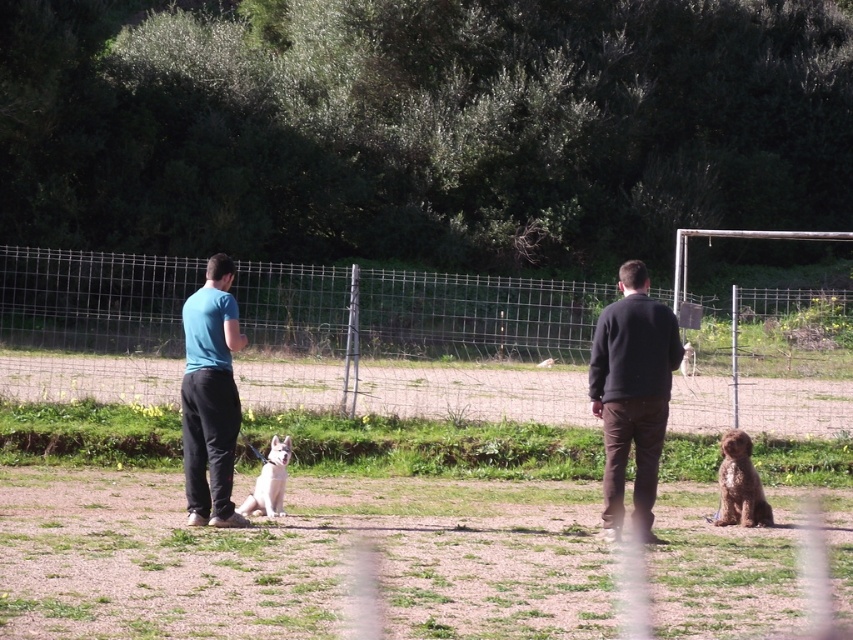
Question: Can you confirm if dark brown sweater at right is positioned to the left of blue cotton shirt at left?

Choices:
 (A) no
 (B) yes

Answer: (A)

Question: Which of the following is the farthest from the observer?

Choices:
 (A) click(x=20, y=316)
 (B) click(x=277, y=452)

Answer: (A)

Question: Can you confirm if brown dirt field at center is positioned below white fur dog at center?

Choices:
 (A) yes
 (B) no

Answer: (A)

Question: Which point is farther to the camera?

Choices:
 (A) coord(169,284)
 (B) coord(270,460)
 (C) coord(751,484)

Answer: (A)

Question: Can you confirm if metallic wire fence at center is wider than blue cotton shirt at left?

Choices:
 (A) yes
 (B) no

Answer: (A)

Question: Estimate the real-world distances between objects in this image. Which object is farther from the white fur dog at center?

Choices:
 (A) brown furry dog at lower right
 (B) dark brown sweater at right
 (C) metallic wire fence at center
 (D) brown dirt field at center

Answer: (C)